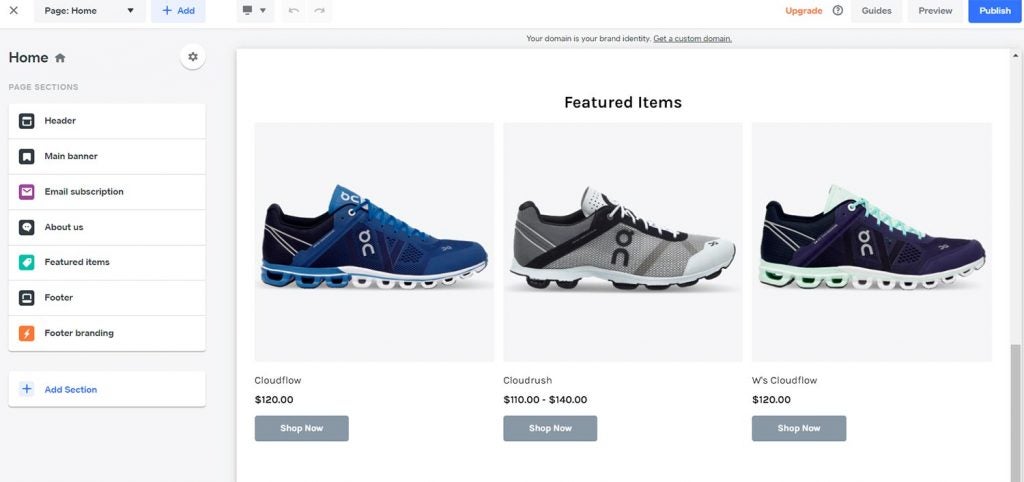
You are a GUI agent. You are given a task and a screenshot of the screen. Output one action in this format:
    pyautogui.click(x=<x>, y=<y>)
    Task: Click on the shoe
    This screenshot has width=1024, height=482.
    Given the screenshot: What is the action you would take?
    pyautogui.click(x=340, y=249), pyautogui.click(x=639, y=250), pyautogui.click(x=863, y=249)